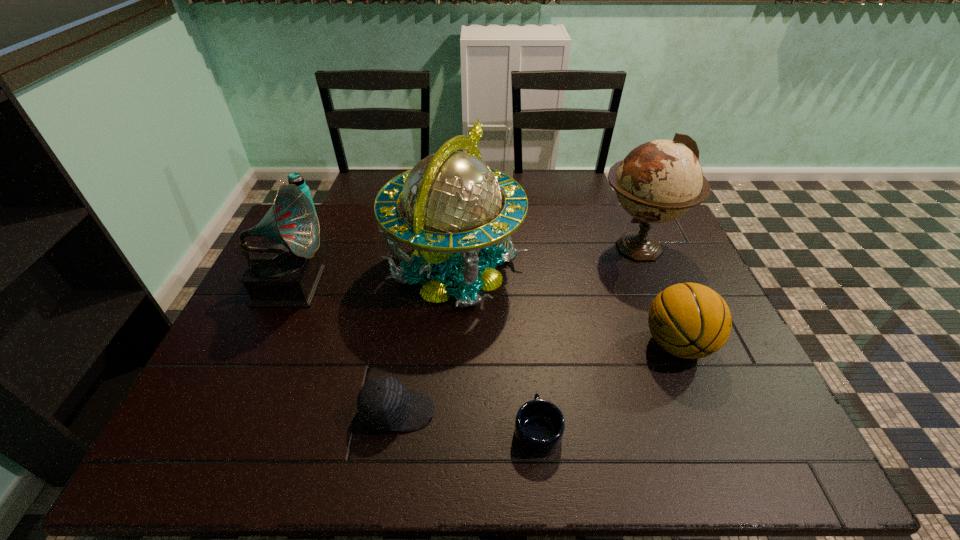
The image size is (960, 540). In the image, there is a desktop. Identify the location of vacant area at the right edge. (698, 369).

Identify the location of free space at the near left corner of the desktop. (203, 446).

Locate an element on the screen. empty space between the basketball and the second shortest object is located at coordinates (538, 378).

This screenshot has width=960, height=540. Identify the location of empty space between the sixth tallest object and the third tallest object. tap(346, 347).

The image size is (960, 540). Find the location of `vacant point located between the right globe and the mug`. vacant point located between the right globe and the mug is located at coordinates (588, 339).

At what (x,y) coordinates should I click in order to perform the action: click on vacant space in between the baseball cap and the water bottle. Please return your answer as a coordinate pair (x, y). Looking at the image, I should click on (354, 318).

I want to click on free space between the third tallest object and the left globe, so [373, 276].

What are the coordinates of `free point between the fifth shortest object and the basketball` in the screenshot? It's located at (485, 314).

Image resolution: width=960 pixels, height=540 pixels. Find the location of `vacant area that lies between the baseball cap and the shortest object`. vacant area that lies between the baseball cap and the shortest object is located at coordinates (468, 421).

What are the coordinates of `vacant space that's between the right globe and the baseball cap` in the screenshot? It's located at (517, 329).